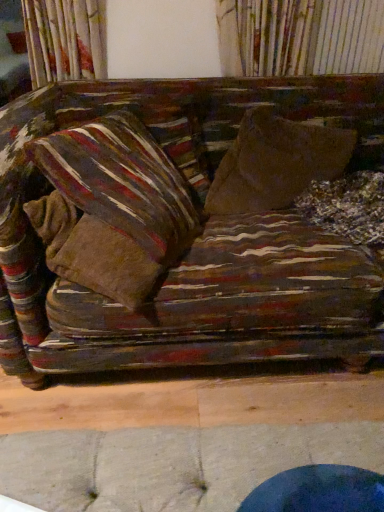
Describe the element at coordinates (155, 131) in the screenshot. This screenshot has width=384, height=512. I see `striped fabric pillow at upper left, the 2th pillow positioned from the front` at that location.

Find the location of a particular element. The height and width of the screenshot is (512, 384). striped fabric pillow at upper left, arranged as the first pillow when viewed from the back is located at coordinates 155,131.

This screenshot has height=512, width=384. Find the location of `striped fabric pillow at left, the 2th pillow when ordered from back to front`. striped fabric pillow at left, the 2th pillow when ordered from back to front is located at coordinates (111, 207).

Where is `striped fabric pillow at upper left, arranged as the first pillow when viewed from the back`? Image resolution: width=384 pixels, height=512 pixels. striped fabric pillow at upper left, arranged as the first pillow when viewed from the back is located at coordinates click(155, 131).

Is striped fabric pillow at left, the 1th pillow viewed from the front, positioned with its back to striped fabric pillow at upper left, the 2th pillow positioned from the front?

Absolutely, striped fabric pillow at left, the 1th pillow viewed from the front, is directed away from striped fabric pillow at upper left, the 2th pillow positioned from the front.

Considering the positions of objects striped fabric pillow at left, the 1th pillow viewed from the front, and striped fabric pillow at upper left, the 2th pillow positioned from the front, in the image provided, who is more to the right, striped fabric pillow at left, the 1th pillow viewed from the front, or striped fabric pillow at upper left, the 2th pillow positioned from the front,?

Positioned to the right is striped fabric pillow at left, the 1th pillow viewed from the front.

From a real-world perspective, is striped fabric pillow at left, the 2th pillow when ordered from back to front, positioned above or below striped fabric pillow at upper left, the 2th pillow positioned from the front?

In terms of real-world spatial position, striped fabric pillow at left, the 2th pillow when ordered from back to front, is above striped fabric pillow at upper left, the 2th pillow positioned from the front.

In the scene shown: From the image's perspective, which is below, striped fabric pillow at left, the 1th pillow viewed from the front, or striped fabric pillow at upper left, the 2th pillow positioned from the front?

striped fabric pillow at left, the 1th pillow viewed from the front.

Is striped fabric pillow at upper left, the 2th pillow positioned from the front, not near striped fabric pillow at left, the 2th pillow when ordered from back to front?

That's not correct — striped fabric pillow at upper left, the 2th pillow positioned from the front, is a little close to striped fabric pillow at left, the 2th pillow when ordered from back to front.

Which of these two, striped fabric pillow at upper left, the 2th pillow positioned from the front, or striped fabric pillow at left, the 2th pillow when ordered from back to front, stands taller?

Standing taller between the two is striped fabric pillow at left, the 2th pillow when ordered from back to front.

Is striped fabric pillow at upper left, arranged as the first pillow when viewed from the back, oriented away from striped fabric pillow at left, the 1th pillow viewed from the front?

Absolutely, striped fabric pillow at upper left, arranged as the first pillow when viewed from the back, is directed away from striped fabric pillow at left, the 1th pillow viewed from the front.

Considering the sizes of objects striped fabric pillow at upper left, the 2th pillow positioned from the front, and striped fabric pillow at left, the 2th pillow when ordered from back to front, in the image provided, who is wider, striped fabric pillow at upper left, the 2th pillow positioned from the front, or striped fabric pillow at left, the 2th pillow when ordered from back to front,?

With larger width is striped fabric pillow at upper left, the 2th pillow positioned from the front.

Is striped fabric pillow at left, the 2th pillow when ordered from back to front, thinner than brown fabric throw pillow at center?

Correct, the width of striped fabric pillow at left, the 2th pillow when ordered from back to front, is less than that of brown fabric throw pillow at center.

Considering the relative sizes of striped fabric pillow at left, the 2th pillow when ordered from back to front, and brown fabric throw pillow at center in the image provided, is striped fabric pillow at left, the 2th pillow when ordered from back to front, smaller than brown fabric throw pillow at center?

Indeed, striped fabric pillow at left, the 2th pillow when ordered from back to front, has a smaller size compared to brown fabric throw pillow at center.

Which point is more distant from viewer, (116, 193) or (258, 130)?

The point (258, 130) is farther.

From a real-world perspective, relative to brown fabric throw pillow at center, is striped fabric pillow at left, the 2th pillow when ordered from back to front, vertically above or below?

striped fabric pillow at left, the 2th pillow when ordered from back to front, is situated higher than brown fabric throw pillow at center in the real world.

From a real-world perspective, is brown fabric throw pillow at center above or below striped fabric pillow at upper left, arranged as the first pillow when viewed from the back?

brown fabric throw pillow at center is situated lower than striped fabric pillow at upper left, arranged as the first pillow when viewed from the back, in the real world.

Is brown fabric throw pillow at center completely or partially outside of striped fabric pillow at upper left, arranged as the first pillow when viewed from the back?

Indeed, brown fabric throw pillow at center is completely outside striped fabric pillow at upper left, arranged as the first pillow when viewed from the back.

What's the angular difference between brown fabric throw pillow at center and striped fabric pillow at upper left, arranged as the first pillow when viewed from the back,'s facing directions?

6.18 degrees separate the facing orientations of brown fabric throw pillow at center and striped fabric pillow at upper left, arranged as the first pillow when viewed from the back.

Considering the sizes of brown fabric throw pillow at center and striped fabric pillow at upper left, arranged as the first pillow when viewed from the back, in the image, is brown fabric throw pillow at center wider or thinner than striped fabric pillow at upper left, arranged as the first pillow when viewed from the back,?

Considering their sizes, brown fabric throw pillow at center looks broader than striped fabric pillow at upper left, arranged as the first pillow when viewed from the back.

Is striped fabric pillow at upper left, arranged as the first pillow when viewed from the back, not inside brown fabric throw pillow at center?

Absolutely, striped fabric pillow at upper left, arranged as the first pillow when viewed from the back, is external to brown fabric throw pillow at center.

Does striped fabric pillow at upper left, the 2th pillow positioned from the front, come behind brown fabric throw pillow at center?

Yes, striped fabric pillow at upper left, the 2th pillow positioned from the front, is further from the viewer.

Between striped fabric pillow at upper left, the 2th pillow positioned from the front, and brown fabric throw pillow at center, which one has smaller width?

striped fabric pillow at upper left, the 2th pillow positioned from the front, is thinner.

Can you confirm if striped fabric pillow at upper left, arranged as the first pillow when viewed from the back, is bigger than brown fabric throw pillow at center?

Incorrect, striped fabric pillow at upper left, arranged as the first pillow when viewed from the back, is not larger than brown fabric throw pillow at center.

Which object is positioned more to the right, brown fabric throw pillow at center or striped fabric pillow at left, the 1th pillow viewed from the front?

From the viewer's perspective, brown fabric throw pillow at center appears more on the right side.

Based on the photo, is brown fabric throw pillow at center placed right next to striped fabric pillow at left, the 1th pillow viewed from the front?

No.

Is brown fabric throw pillow at center bigger than striped fabric pillow at left, the 2th pillow when ordered from back to front?

Indeed, brown fabric throw pillow at center has a larger size compared to striped fabric pillow at left, the 2th pillow when ordered from back to front.

Find the location of a particular element. pillow behind the striped fabric pillow at left, the 1th pillow viewed from the front is located at coordinates (155, 131).

Identify the location of pillow that is in front of the striped fabric pillow at upper left, the 2th pillow positioned from the front. This screenshot has width=384, height=512. (111, 207).

Considering their positions, is striped fabric pillow at upper left, arranged as the first pillow when viewed from the back, positioned closer to brown fabric throw pillow at center than striped fabric pillow at left, the 1th pillow viewed from the front?

Among the two, striped fabric pillow at upper left, arranged as the first pillow when viewed from the back, is located nearer to brown fabric throw pillow at center.

Looking at the image, which one is located closer to striped fabric pillow at left, the 2th pillow when ordered from back to front, brown fabric throw pillow at center or striped fabric pillow at upper left, arranged as the first pillow when viewed from the back?

striped fabric pillow at upper left, arranged as the first pillow when viewed from the back, is positioned closer to the anchor striped fabric pillow at left, the 2th pillow when ordered from back to front.

Which object lies nearer to the anchor point striped fabric pillow at upper left, arranged as the first pillow when viewed from the back, brown fabric throw pillow at center or striped fabric pillow at left, the 2th pillow when ordered from back to front?

striped fabric pillow at left, the 2th pillow when ordered from back to front.

Considering their positions, is striped fabric pillow at left, the 1th pillow viewed from the front, positioned closer to striped fabric pillow at upper left, the 2th pillow positioned from the front, than brown fabric throw pillow at center?

Among the two, striped fabric pillow at left, the 1th pillow viewed from the front, is located nearer to striped fabric pillow at upper left, the 2th pillow positioned from the front.

Based on the photo, considering their positions, is striped fabric pillow at left, the 1th pillow viewed from the front, positioned further to brown fabric throw pillow at center than striped fabric pillow at upper left, arranged as the first pillow when viewed from the back?

The object further to brown fabric throw pillow at center is striped fabric pillow at left, the 1th pillow viewed from the front.

When comparing their distances from striped fabric pillow at left, the 1th pillow viewed from the front, does striped fabric pillow at upper left, arranged as the first pillow when viewed from the back, or brown fabric throw pillow at center seem further?

Among the two, brown fabric throw pillow at center is located further to striped fabric pillow at left, the 1th pillow viewed from the front.

You are a GUI agent. You are given a task and a screenshot of the screen. Output one action in this format:
    pyautogui.click(x=<x>, y=<y>)
    Task: Click on the pillow situated between striped fabric pillow at upper left, the 2th pillow positioned from the front, and brown fabric throw pillow at center from left to right
    The width and height of the screenshot is (384, 512).
    Given the screenshot: What is the action you would take?
    pyautogui.click(x=111, y=207)